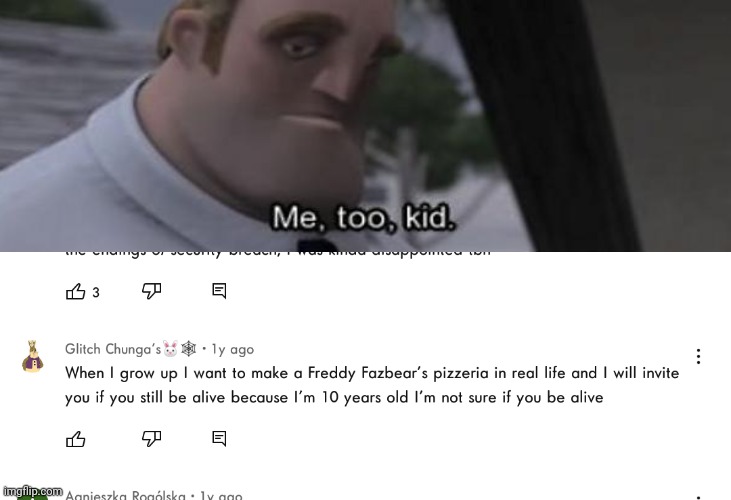
The width and height of the screenshot is (731, 500). I want to click on wall, so click(655, 89).